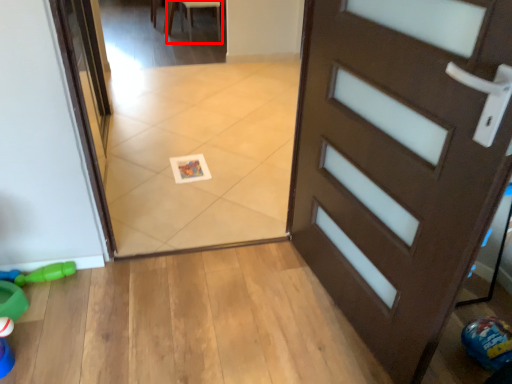
Question: Observing the image, what is the correct spatial positioning of chair (annotated by the red box) in reference to toy?

Choices:
 (A) right
 (B) left

Answer: (A)